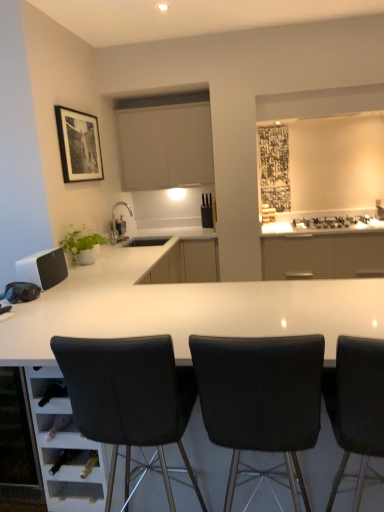
Question: Considering the relative sizes of black leather chair at center, which is the 3th chair in right-to-left order, and white glossy table at center in the image provided, is black leather chair at center, which is the 3th chair in right-to-left order, wider than white glossy table at center?

Choices:
 (A) yes
 (B) no

Answer: (B)

Question: From the image's perspective, does black leather chair at center, which is the 3th chair in right-to-left order, appear higher than white glossy table at center?

Choices:
 (A) no
 (B) yes

Answer: (A)

Question: From the image's perspective, is black leather chair at center, which ranks as the first chair in left-to-right order, below white glossy table at center?

Choices:
 (A) no
 (B) yes

Answer: (B)

Question: Does black leather chair at center, which ranks as the first chair in left-to-right order, come behind white glossy table at center?

Choices:
 (A) yes
 (B) no

Answer: (B)

Question: Considering the relative sizes of black leather chair at center, which is the 3th chair in right-to-left order, and white glossy table at center in the image provided, is black leather chair at center, which is the 3th chair in right-to-left order, thinner than white glossy table at center?

Choices:
 (A) yes
 (B) no

Answer: (A)

Question: From the image's perspective, relative to matte black speaker at left, is black matte gas stove at upper right above or below?

Choices:
 (A) above
 (B) below

Answer: (A)

Question: Is black matte gas stove at upper right bigger or smaller than matte black speaker at left?

Choices:
 (A) small
 (B) big

Answer: (B)

Question: Does point (307, 226) appear closer or farther from the camera than point (51, 272)?

Choices:
 (A) farther
 (B) closer

Answer: (A)

Question: Is black matte gas stove at upper right wider or thinner than matte black speaker at left?

Choices:
 (A) wide
 (B) thin

Answer: (A)

Question: From a real-world perspective, is black fabric chair at center, placed as the 2th chair when sorted from right to left, positioned above or below black matte gas stove at upper right?

Choices:
 (A) above
 (B) below

Answer: (B)

Question: Considering the positions of black fabric chair at center, the second chair viewed from the left, and black matte gas stove at upper right in the image, is black fabric chair at center, the second chair viewed from the left, wider or thinner than black matte gas stove at upper right?

Choices:
 (A) thin
 (B) wide

Answer: (B)

Question: In the image, is black fabric chair at center, the second chair viewed from the left, positioned in front of or behind black matte gas stove at upper right?

Choices:
 (A) behind
 (B) front

Answer: (B)

Question: Is black fabric chair at center, the second chair viewed from the left, to the left or to the right of black matte gas stove at upper right in the image?

Choices:
 (A) left
 (B) right

Answer: (A)

Question: Based on their sizes in the image, would you say matte black speaker at left is bigger or smaller than matte beige cabinet at upper center?

Choices:
 (A) big
 (B) small

Answer: (B)

Question: From the image's perspective, is matte black speaker at left positioned above or below matte beige cabinet at upper center?

Choices:
 (A) below
 (B) above

Answer: (A)